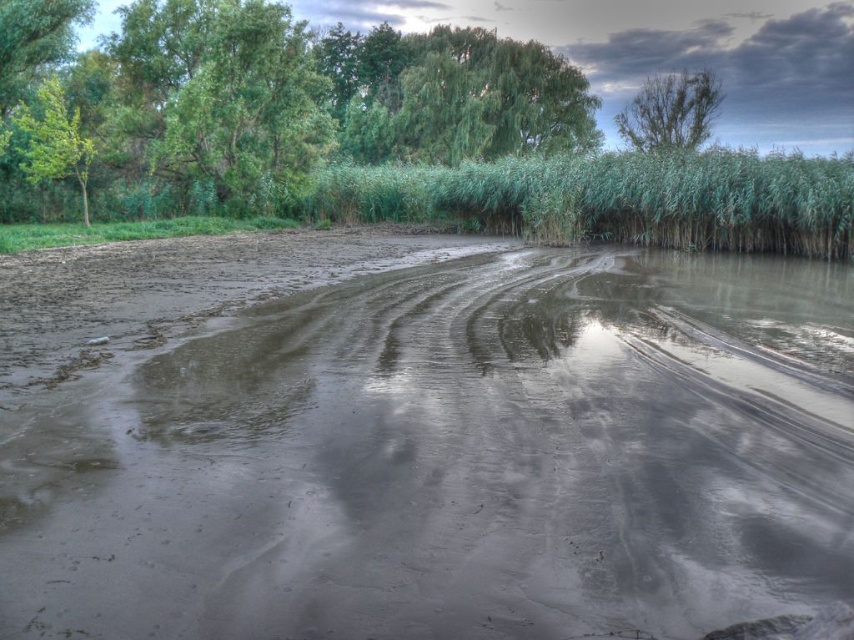
Is point (383, 49) farther from viewer compared to point (62, 163)?

Yes, it is.

What do you see at coordinates (453, 96) in the screenshot? This screenshot has width=854, height=640. I see `green leafy tree at upper center` at bounding box center [453, 96].

Where is `green leafy tree at upper center`? This screenshot has height=640, width=854. green leafy tree at upper center is located at coordinates (453, 96).

Is point (553, 108) less distant than point (715, 97)?

No, (553, 108) is behind (715, 97).

Which is in front, point (533, 108) or point (642, 124)?

Point (642, 124) is in front.

At what (x,y) coordinates should I click in order to perform the action: click on green leafy tree at upper center. Please return your answer as a coordinate pair (x, y). Looking at the image, I should click on (453, 96).

Looking at this image, can you confirm if muddy wetland at center is positioned above green leafy tree at upper left?

No, muddy wetland at center is not above green leafy tree at upper left.

Measure the distance between point [531,278] and camera.

Point [531,278] and camera are 17.03 meters apart.

Find the location of a particular element. The width and height of the screenshot is (854, 640). muddy wetland at center is located at coordinates (422, 442).